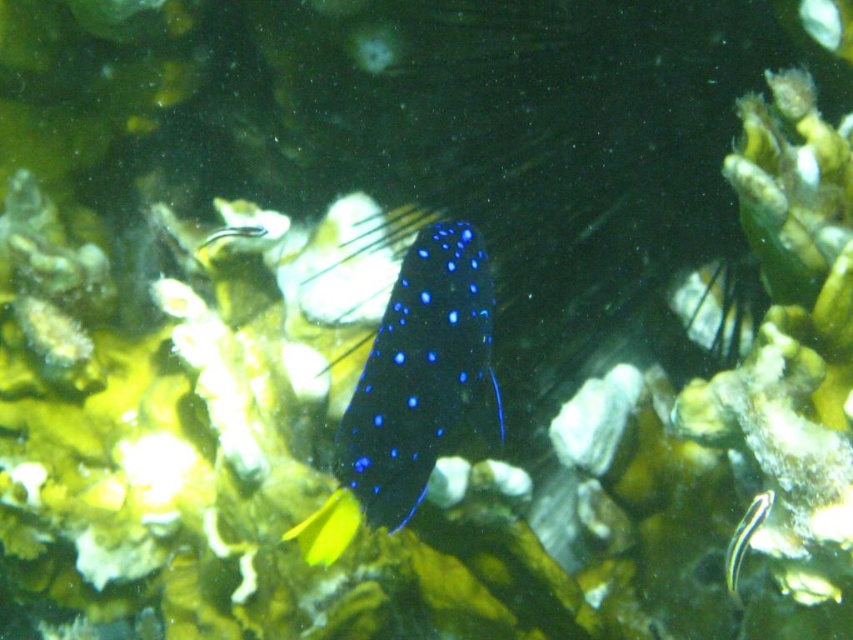
Can you confirm if glossy blue fish at center is smaller than black glossy stripe at lower right?

Incorrect, glossy blue fish at center is not smaller in size than black glossy stripe at lower right.

Does point (412, 451) come behind point (747, 522)?

That is False.

Who is more forward, (355,448) or (756,518)?

Point (355,448) is more forward.

Where is `glossy blue fish at center`? The height and width of the screenshot is (640, 853). glossy blue fish at center is located at coordinates (409, 388).